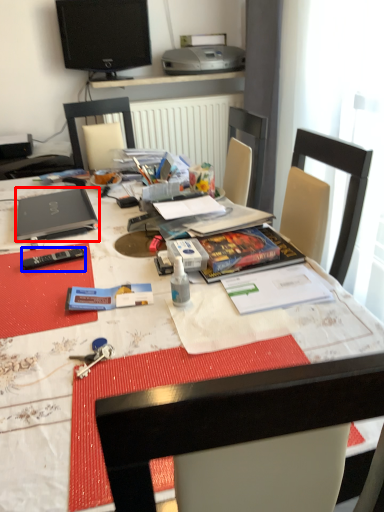
Question: Which point is closer to the camera, laptop (highlighted by a red box) or remote control (highlighted by a blue box)?

Choices:
 (A) laptop
 (B) remote control

Answer: (B)